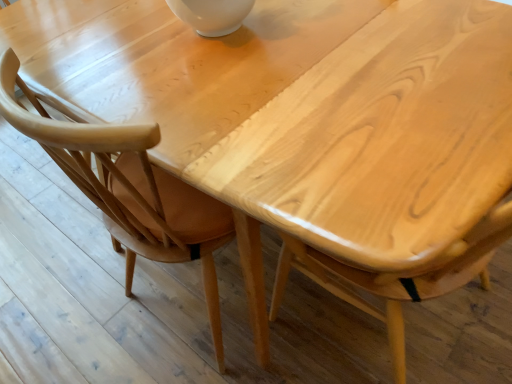
Find the location of `light brown wood chair at center`. light brown wood chair at center is located at coordinates (128, 189).

This screenshot has width=512, height=384. What do you see at coordinates (128, 189) in the screenshot?
I see `light brown wood chair at center` at bounding box center [128, 189].

This screenshot has height=384, width=512. I want to click on light brown wood chair at center, so click(x=128, y=189).